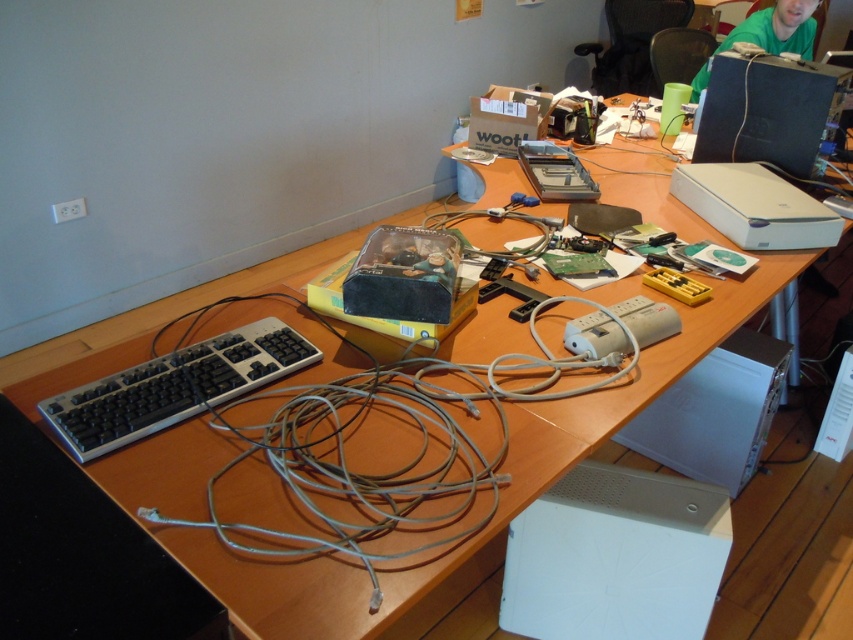
You are a delivery person who just arrived at the office. You need to place a new monitor that is 3 feet wide on the desk. The monitor requires 5 feet of space from the edge of the desk to the back wall. Is there enough space between the white plastic desktop computer at lower right and the back wall to accommodate the monitor?

The white plastic desktop computer at lower right is 4.60 feet away from the camera. Since the monitor needs 5 feet of space, there isn